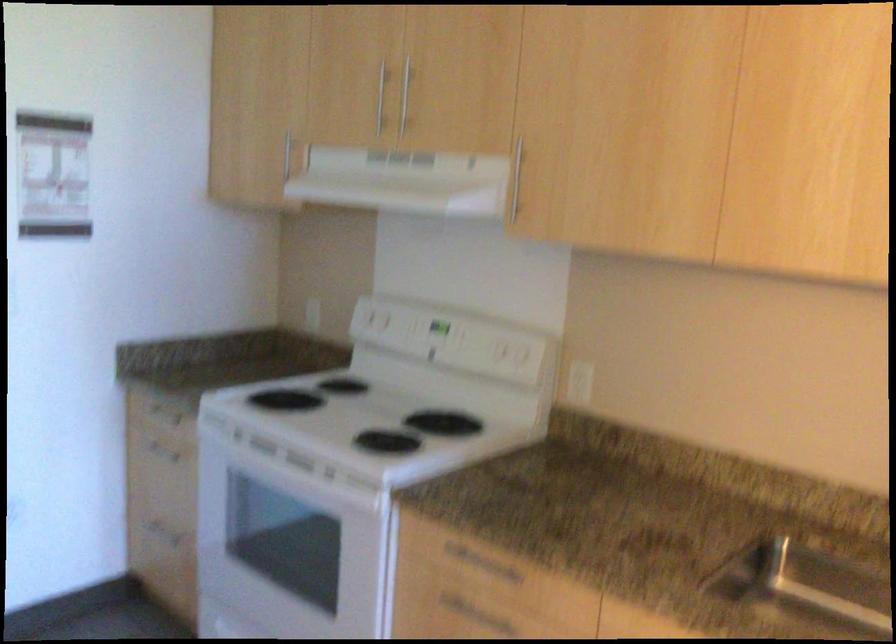
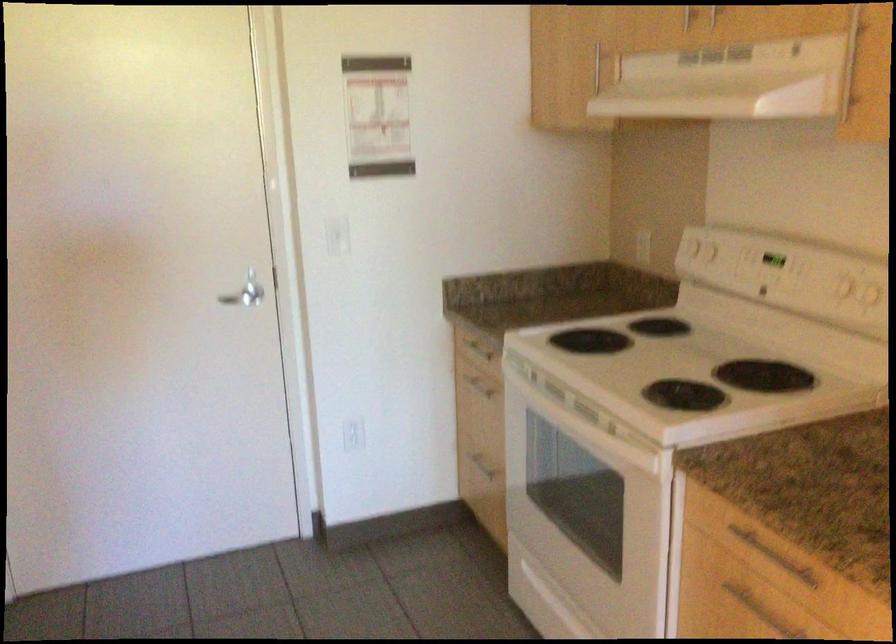
Where in the second image is the point corresponding to (158,534) from the first image?

(478, 462)